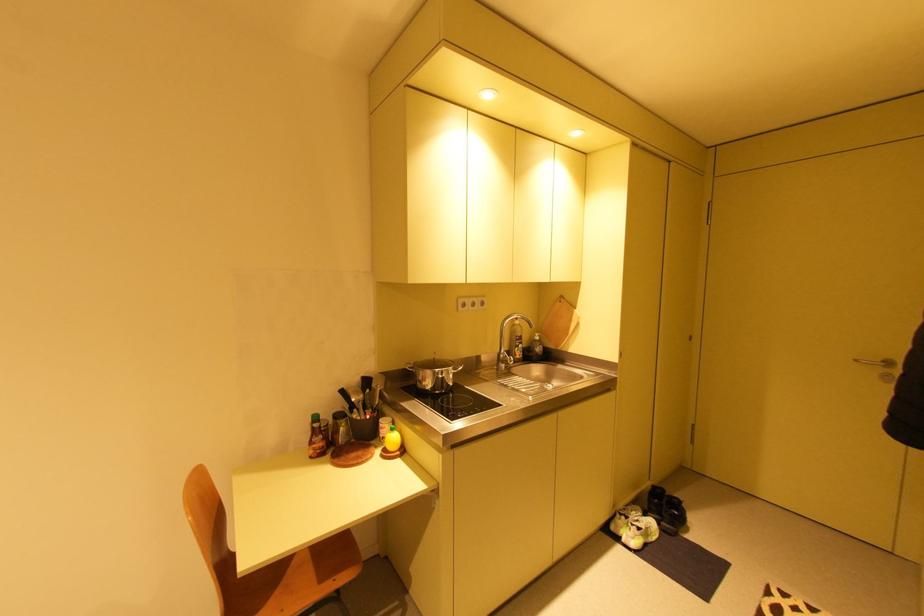
This screenshot has width=924, height=616. What do you see at coordinates (505, 360) in the screenshot? I see `the metal faucet handle` at bounding box center [505, 360].